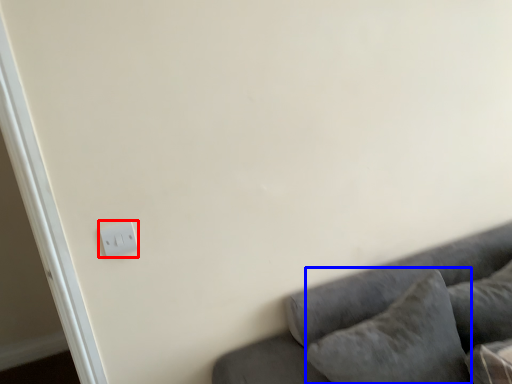
Question: Which object is further to the camera taking this photo, light switch (highlighted by a red box) or pillow (highlighted by a blue box)?

Choices:
 (A) light switch
 (B) pillow

Answer: (A)